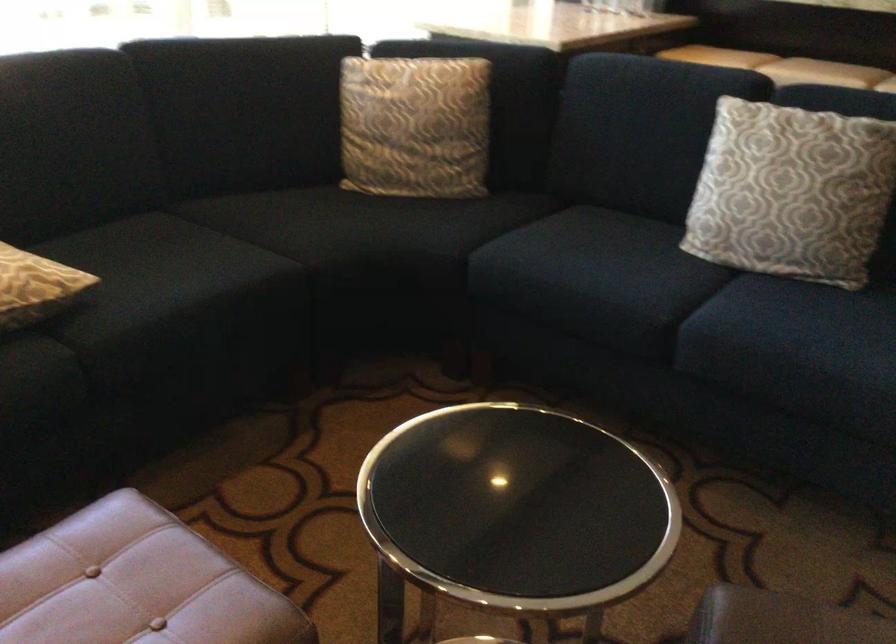
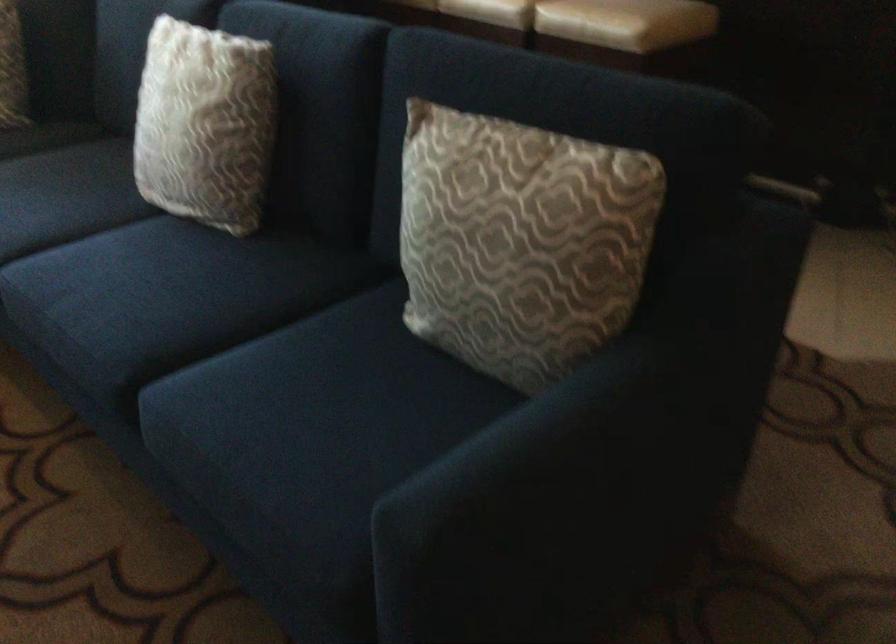
Question: In a continuous first-person perspective shot, in which direction is the camera moving?

Choices:
 (A) Left
 (B) Right
 (C) Forward
 (D) Backward

Answer: (B)